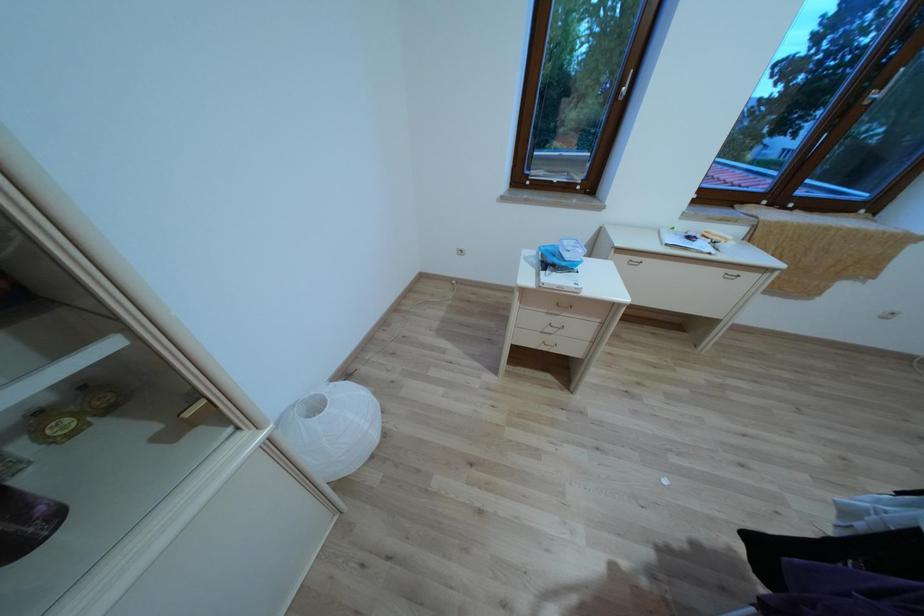
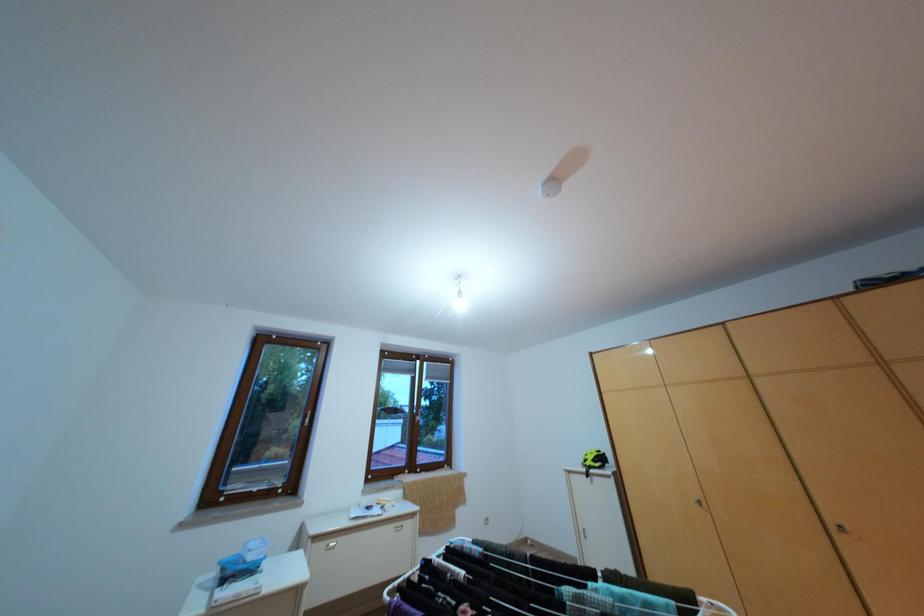
How did the camera likely rotate?

The camera's rotation is toward right-up.